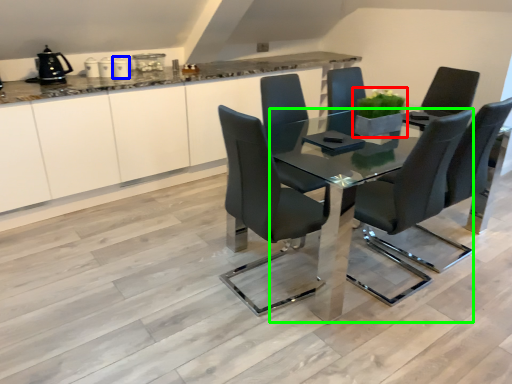
Question: Which is nearer to the houseplant (highlighted by a red box)? appliance (highlighted by a blue box) or table (highlighted by a green box).

Choices:
 (A) appliance
 (B) table

Answer: (B)